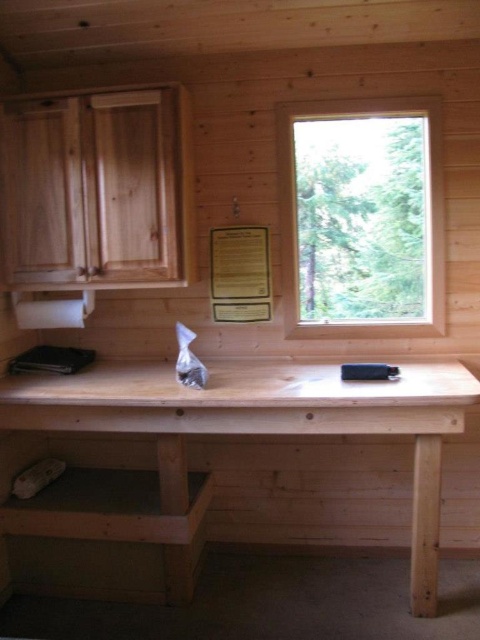
Question: Where is natural wood table at center located in relation to clear glass window at upper right in the image?

Choices:
 (A) left
 (B) right

Answer: (A)

Question: Does natural wood table at center appear on the left side of clear glass window at upper right?

Choices:
 (A) no
 (B) yes

Answer: (B)

Question: Where is natural wood table at center located in relation to clear glass window at upper right in the image?

Choices:
 (A) below
 (B) above

Answer: (A)

Question: Which point is farther from the camera taking this photo?

Choices:
 (A) (386, 112)
 (B) (419, 509)

Answer: (A)